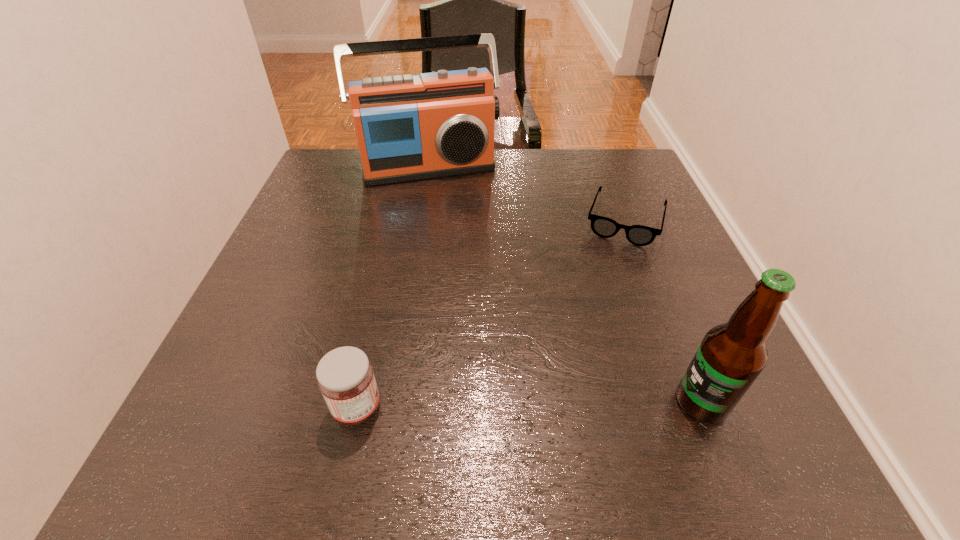
Where is `blank region between the jam and the shortest object`? The image size is (960, 540). blank region between the jam and the shortest object is located at coordinates (491, 314).

At what (x,y) coordinates should I click in order to perform the action: click on vacant space that is in between the jam and the second tallest object. Please return your answer as a coordinate pair (x, y). Looking at the image, I should click on (529, 405).

The height and width of the screenshot is (540, 960). Identify the location of free spot between the spectacles and the second tallest object. coord(663,312).

This screenshot has width=960, height=540. I want to click on blank region between the spectacles and the second tallest object, so click(x=663, y=312).

This screenshot has width=960, height=540. In order to click on blank region between the radio receiver and the third tallest object in this screenshot , I will do `click(393, 287)`.

Find the location of a particular element. The width and height of the screenshot is (960, 540). vacant area between the radio receiver and the beer bottle is located at coordinates (564, 285).

Image resolution: width=960 pixels, height=540 pixels. Identify the location of free point between the farthest object and the third tallest object. (393, 287).

Image resolution: width=960 pixels, height=540 pixels. I want to click on free space that is in between the spectacles and the farthest object, so click(526, 194).

The height and width of the screenshot is (540, 960). I want to click on vacant region between the beer bottle and the second shortest object, so click(529, 405).

Locate an element on the screen. Image resolution: width=960 pixels, height=540 pixels. empty space between the beer bottle and the spectacles is located at coordinates (663, 312).